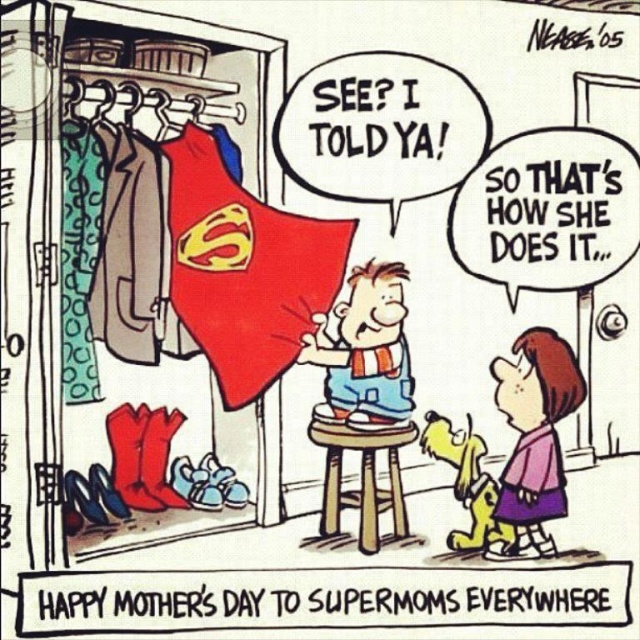
Question: Can you confirm if purple fabric dress at lower center is thinner than smooth blue shorts at center?

Choices:
 (A) yes
 (B) no

Answer: (A)

Question: Which object is positioned farthest from the wooden stool at center?

Choices:
 (A) smooth blue shorts at center
 (B) purple fabric dress at lower center

Answer: (B)

Question: Is purple fabric dress at lower center to the left of wooden stool at center from the viewer's perspective?

Choices:
 (A) yes
 (B) no

Answer: (B)

Question: Which is farther from the smooth blue shorts at center?

Choices:
 (A) wooden stool at center
 (B) purple fabric dress at lower center

Answer: (B)

Question: Which object is the farthest from the smooth blue shorts at center?

Choices:
 (A) purple fabric dress at lower center
 (B) wooden stool at center

Answer: (A)

Question: Is smooth blue shorts at center further to camera compared to wooden stool at center?

Choices:
 (A) yes
 (B) no

Answer: (A)